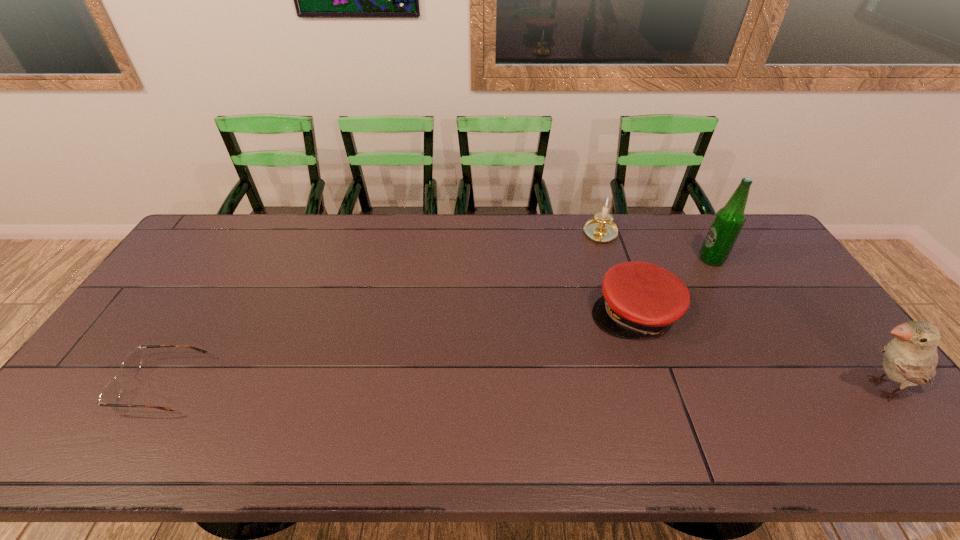
Where is `free region located 0.360m on the handle side of the candle holder`? free region located 0.360m on the handle side of the candle holder is located at coordinates (598, 327).

You are a GUI agent. You are given a task and a screenshot of the screen. Output one action in this format:
    pyautogui.click(x=<x>, y=<y>)
    Task: Click on the free space located on the label of the second object from right to left
    The height and width of the screenshot is (540, 960).
    Given the screenshot: What is the action you would take?
    pyautogui.click(x=673, y=294)

Locate an element on the screen. This screenshot has height=540, width=960. blank space located on the label of the second object from right to left is located at coordinates (662, 303).

Identify the location of vacant space located on the label of the second object from right to left. This screenshot has width=960, height=540. (673, 294).

At what (x,y) coordinates should I click in order to perform the action: click on candle holder that is at the far edge. Please return your answer as a coordinate pair (x, y). The width and height of the screenshot is (960, 540). Looking at the image, I should click on (601, 228).

The height and width of the screenshot is (540, 960). I want to click on beer bottle located at the far edge, so click(726, 226).

Where is `spectacles that is at the near edge`? The height and width of the screenshot is (540, 960). spectacles that is at the near edge is located at coordinates (110, 394).

Find the location of a particular element. The height and width of the screenshot is (540, 960). bird positioned at the near edge is located at coordinates (910, 359).

The height and width of the screenshot is (540, 960). Find the location of `object present at the left edge`. object present at the left edge is located at coordinates (110, 394).

The image size is (960, 540). In order to click on object that is at the right edge in this screenshot , I will do `click(910, 359)`.